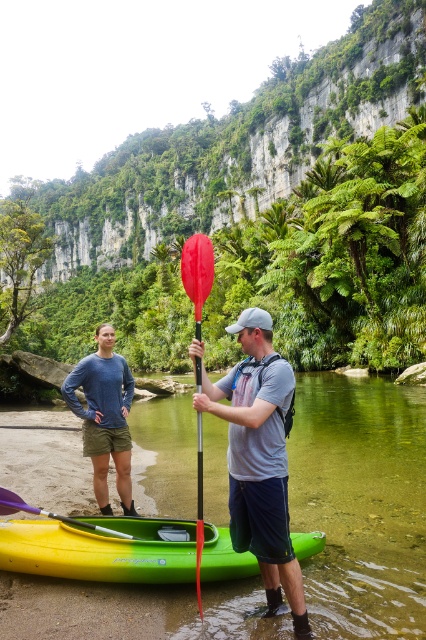
Question: Which object is positioned closest to the green rubber kayak at lower center?

Choices:
 (A) matte blue shirt at center
 (B) red matte paddle at center

Answer: (B)

Question: Among these points, which one is nearest to the camera?

Choices:
 (A) (118, 435)
 (B) (412, 476)
 (C) (74, 573)
 (D) (187, 273)

Answer: (C)

Question: Among these points, which one is nearest to the camera?

Choices:
 (A) (106, 416)
 (B) (91, 516)

Answer: (B)

Question: Does matte blue shirt at center have a lesser width compared to red matte paddle at center?

Choices:
 (A) no
 (B) yes

Answer: (A)

Question: Is matte black kayak at center bigger than yellow-green plastic canoe at lower center?

Choices:
 (A) no
 (B) yes

Answer: (B)

Question: Does matte black kayak at center have a greater width compared to red matte paddle at center?

Choices:
 (A) no
 (B) yes

Answer: (A)